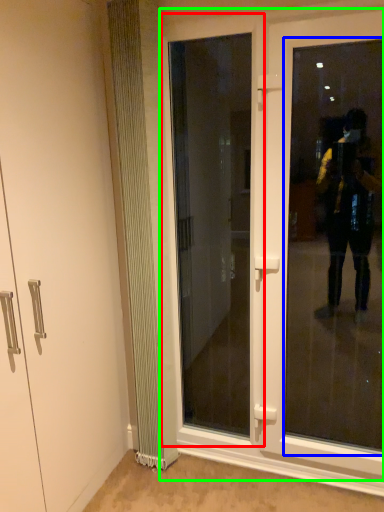
Question: Considering the real-world distances, which object is farthest from door (highlighted by a red box)? window screen (highlighted by a blue box) or door (highlighted by a green box)?

Choices:
 (A) window screen
 (B) door

Answer: (B)